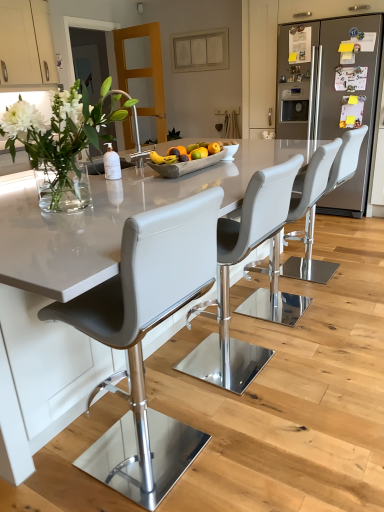
Locate an element on the screen. The image size is (384, 512). vacant region below clear glass vase at left (from a real-world perspective) is located at coordinates (57, 214).